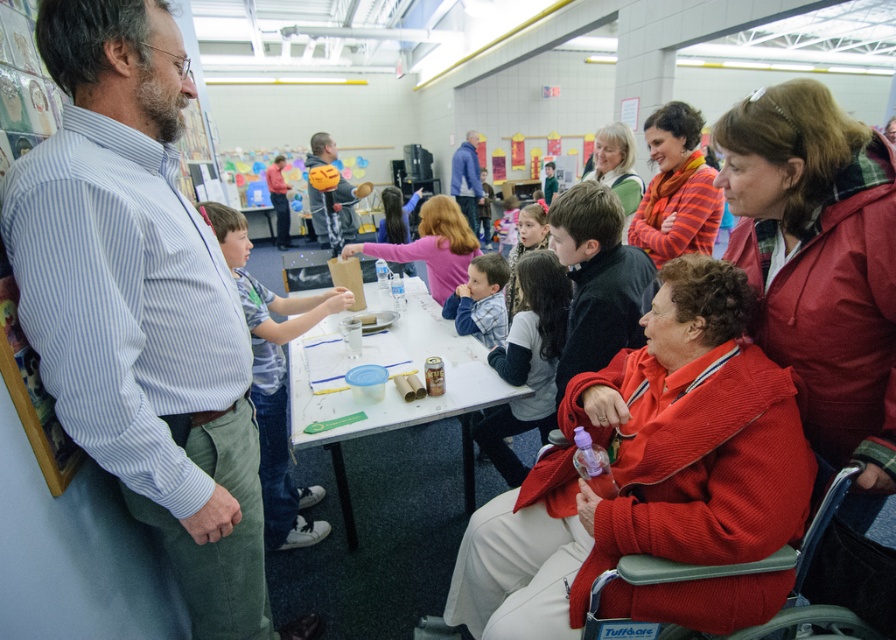
The image size is (896, 640). Find the location of `gray fabric wheelchair at lower right`. gray fabric wheelchair at lower right is located at coordinates (733, 576).

Measure the distance from gray fabric wheelchair at lower right to matte green sweater at upper center.

5.66 feet

The width and height of the screenshot is (896, 640). What do you see at coordinates (733, 576) in the screenshot?
I see `gray fabric wheelchair at lower right` at bounding box center [733, 576].

Where is `gray fabric wheelchair at lower right`? gray fabric wheelchair at lower right is located at coordinates (733, 576).

Is plaid fabric shirt at center bigger than orange helmet at center?

No, plaid fabric shirt at center is not bigger than orange helmet at center.

Can you confirm if plaid fabric shirt at center is taller than orange helmet at center?

No, plaid fabric shirt at center is not taller than orange helmet at center.

The image size is (896, 640). Identify the location of plaid fabric shirt at center. (480, 300).

Which is more to the right, gray fabric wheelchair at lower right or pink fabric shirt at center?

Positioned to the right is gray fabric wheelchair at lower right.

Is point (770, 557) farther from viewer compared to point (466, 280)?

No, it is in front of (466, 280).

I want to click on gray fabric wheelchair at lower right, so [733, 576].